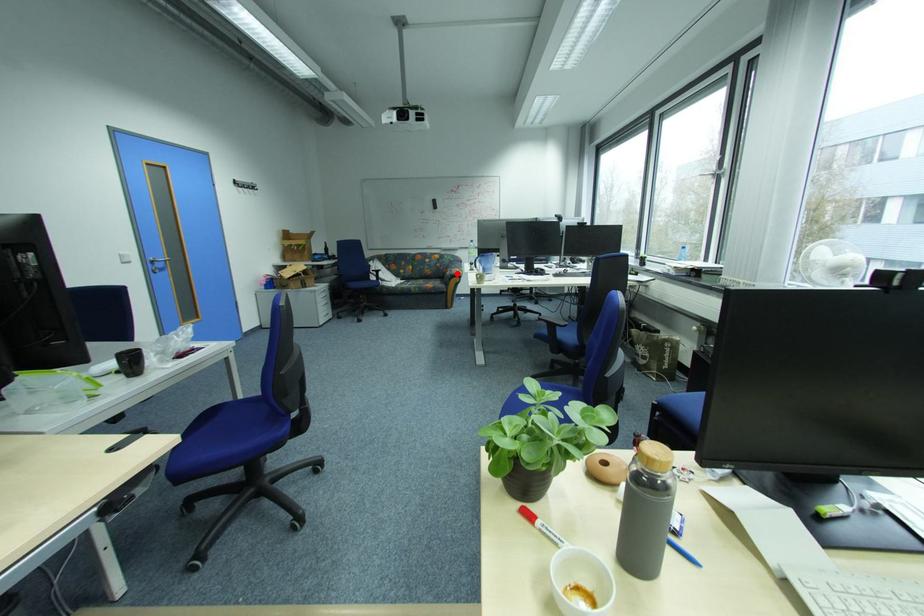
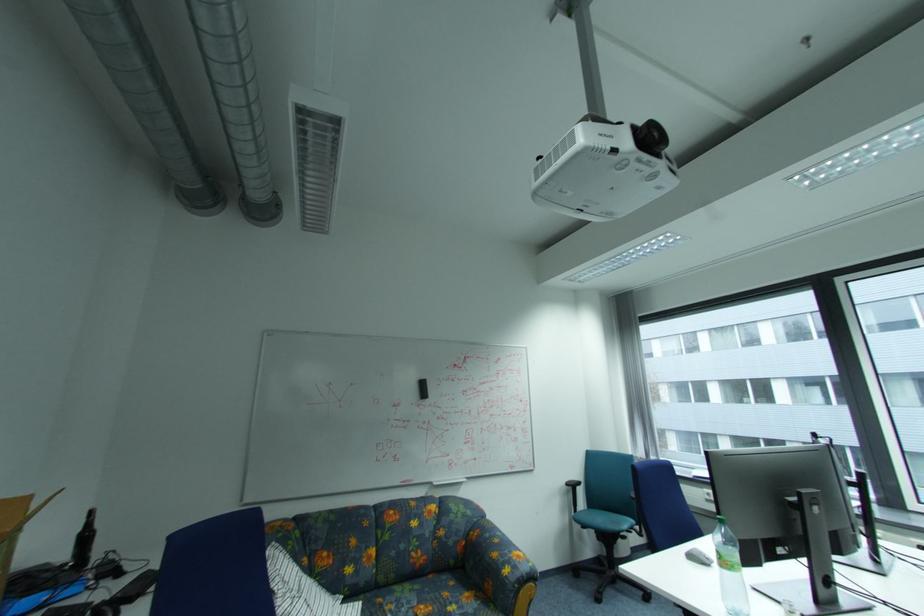
The point at the highlighted location is marked in the first image. Where is the corresponding point in the second image?

(515, 572)